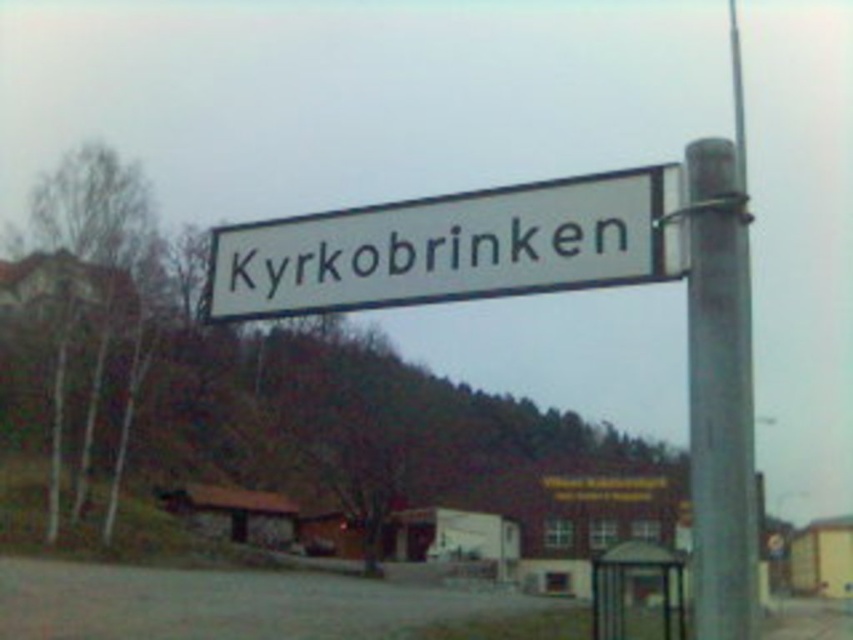
Is white plastic street sign at center thinner than metallic gray pole at right?

Correct, white plastic street sign at center's width is less than metallic gray pole at right's.

Is point (338, 296) more distant than point (695, 356)?

Yes.

Identify the location of white plastic street sign at center. (453, 248).